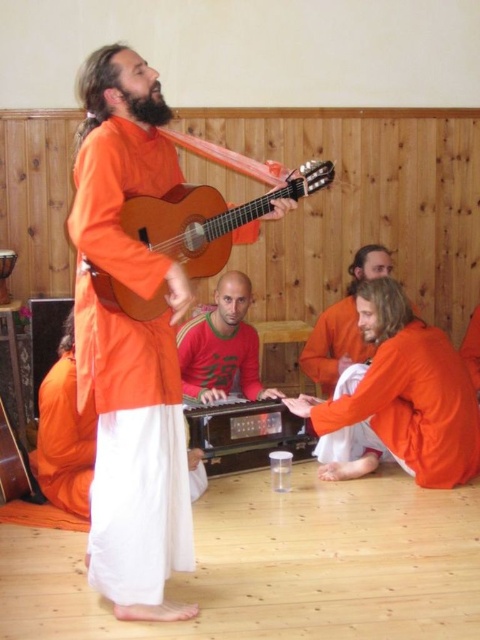
Question: Does matte orange guitar at center appear on the left side of wooden acoustic guitar at center?

Choices:
 (A) no
 (B) yes

Answer: (B)

Question: Is orange cotton robe at center smaller than orange cotton robe at lower right?

Choices:
 (A) yes
 (B) no

Answer: (B)

Question: Which point is closer to the camera?

Choices:
 (A) wooden acoustic guitar at center
 (B) orange cotton robe at center

Answer: (B)

Question: Which of the following is the closest to the observer?

Choices:
 (A) matte orange guitar at center
 (B) orange cotton robe at center
 (C) wooden acoustic guitar at center
 (D) orange cotton robe at lower right

Answer: (A)

Question: Can you confirm if red matte sweater at center is thinner than orange cotton shirt at lower center?

Choices:
 (A) yes
 (B) no

Answer: (B)

Question: Among these points, which one is nearest to the camera?

Choices:
 (A) (404, 374)
 (B) (347, 326)
 (C) (155, 396)

Answer: (C)